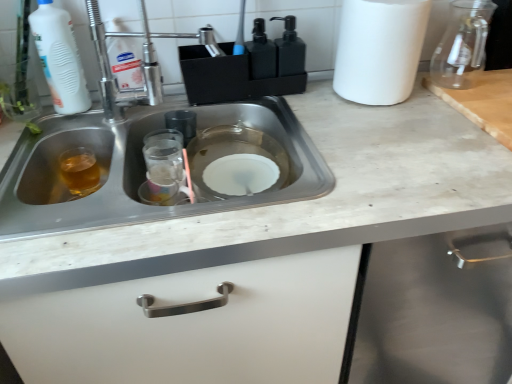
Locate an element on the screen. This screenshot has width=512, height=384. vacant area that is situated to the right of white matte paper towel at upper right is located at coordinates (439, 89).